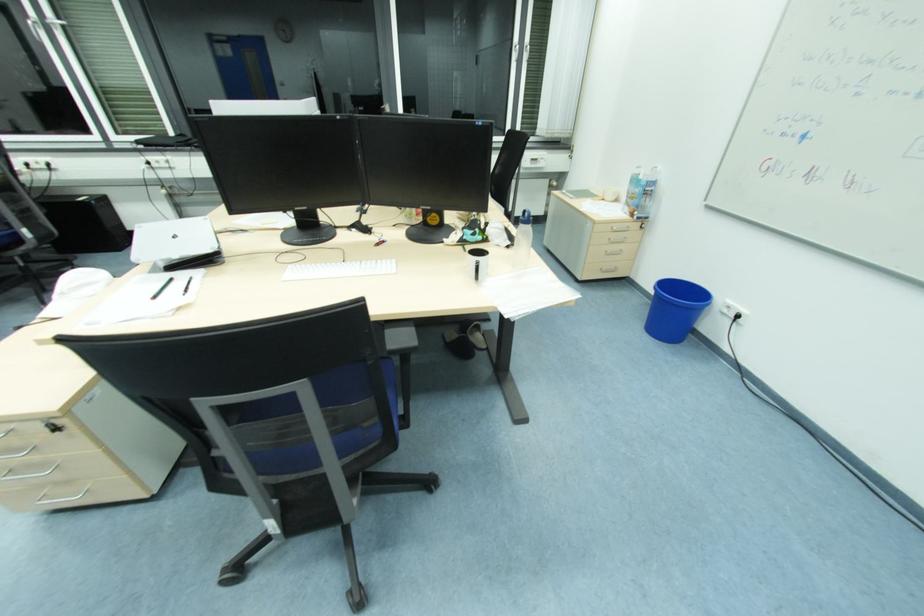
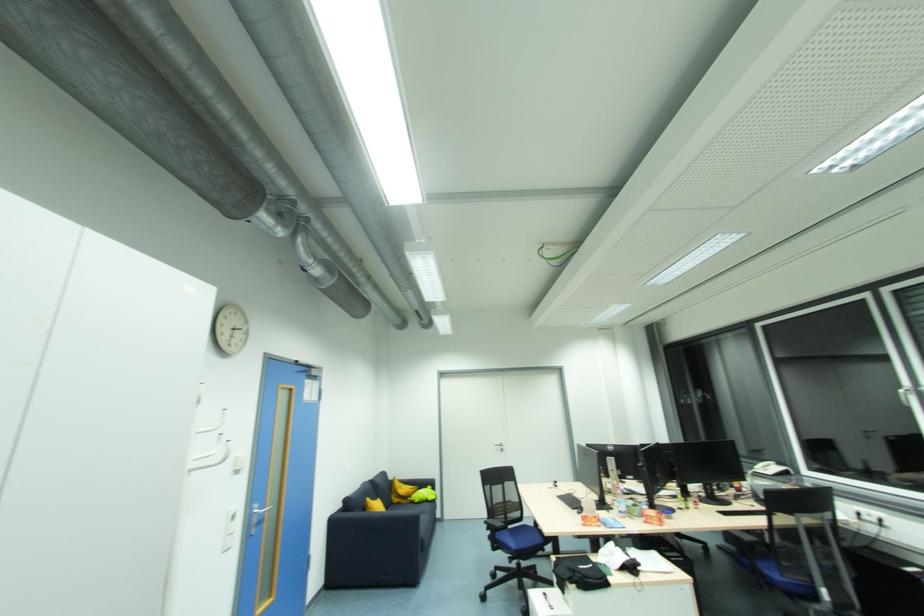
Question: The camera is either moving clockwise (left) or counter-clockwise (right) around the object. The first image is from the beginning of the video and the second image is from the end. Is the camera moving left or right when shooting the video?

Choices:
 (A) Left
 (B) Right

Answer: (B)